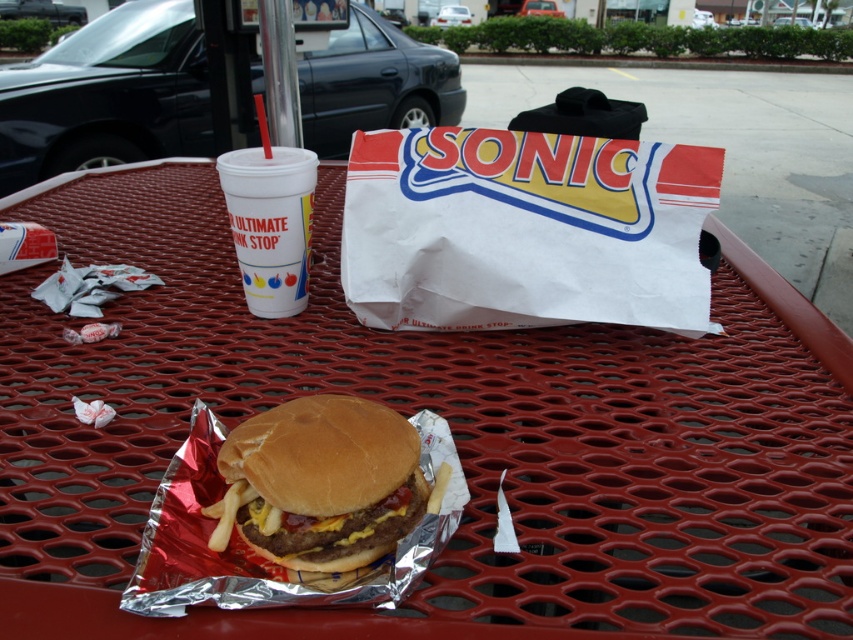
Is brown toasted bun at center to the right of white styrofoam cup at center from the viewer's perspective?

Yes, brown toasted bun at center is to the right of white styrofoam cup at center.

The width and height of the screenshot is (853, 640). In order to click on brown toasted bun at center in this screenshot , I will do `click(320, 483)`.